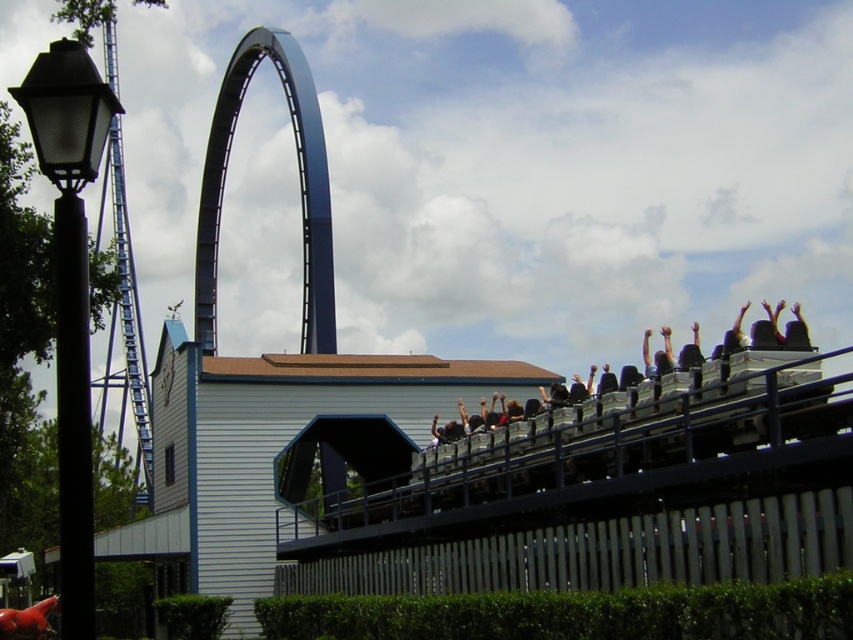
Question: Is green leafy hedge at lower center in front of blue metallic roller coaster at upper center?

Choices:
 (A) yes
 (B) no

Answer: (A)

Question: Based on their relative distances, which object is nearer to the blue metallic roller coaster at upper center?

Choices:
 (A) metallic silver fence at lower center
 (B) green leafy hedge at lower center
 (C) matte black seats at upper right

Answer: (C)

Question: Which object is positioned farthest from the blue metallic roller coaster at upper center?

Choices:
 (A) metallic silver fence at lower center
 (B) matte black seats at upper right
 (C) green leafy hedge at lower center

Answer: (C)

Question: Which of the following is the farthest from the observer?

Choices:
 (A) blue metallic roller coaster at upper center
 (B) green leafy hedge at lower center

Answer: (A)

Question: Is green leafy hedge at lower center closer to camera compared to matte black seats at upper right?

Choices:
 (A) yes
 (B) no

Answer: (A)

Question: Does metallic silver fence at lower center appear under blue metallic roller coaster at upper center?

Choices:
 (A) yes
 (B) no

Answer: (A)